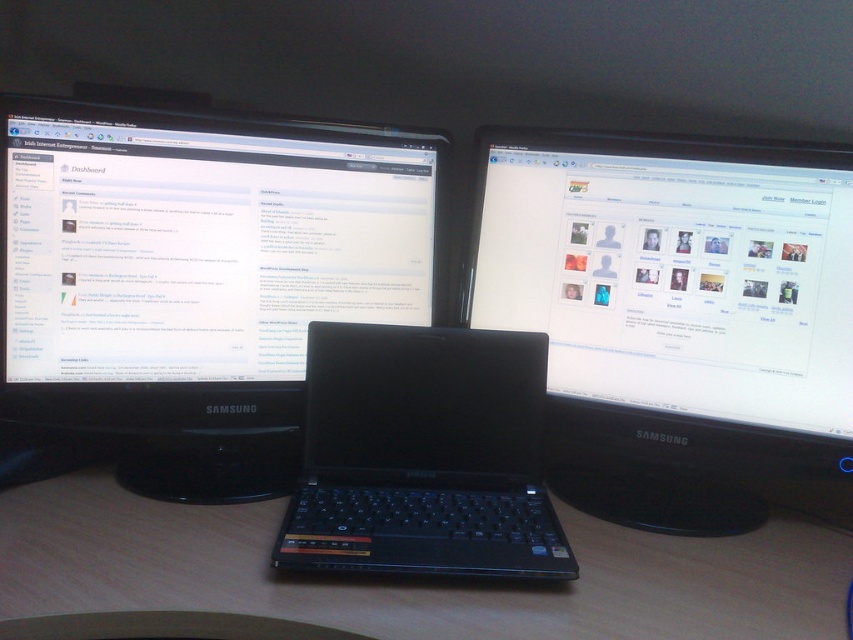
Question: Which of the following is the closest to the observer?

Choices:
 (A) matte black monitor at center
 (B) black plastic laptop at center

Answer: (B)

Question: Which object is the closest to the wooden at center?

Choices:
 (A) black glossy monitor at upper left
 (B) black plastic laptop at center
 (C) matte black monitor at center

Answer: (B)

Question: Can you confirm if matte black monitor at center is positioned to the left of wooden at center?

Choices:
 (A) yes
 (B) no

Answer: (B)

Question: Can you confirm if black glossy monitor at upper left is thinner than matte black monitor at center?

Choices:
 (A) yes
 (B) no

Answer: (B)

Question: From the image, what is the correct spatial relationship of matte black monitor at center in relation to black plastic laptop at center?

Choices:
 (A) below
 (B) above

Answer: (B)

Question: Which of these objects is positioned farthest from the matte black monitor at center?

Choices:
 (A) black glossy monitor at upper left
 (B) wooden at center
 (C) black plastic laptop at center

Answer: (A)